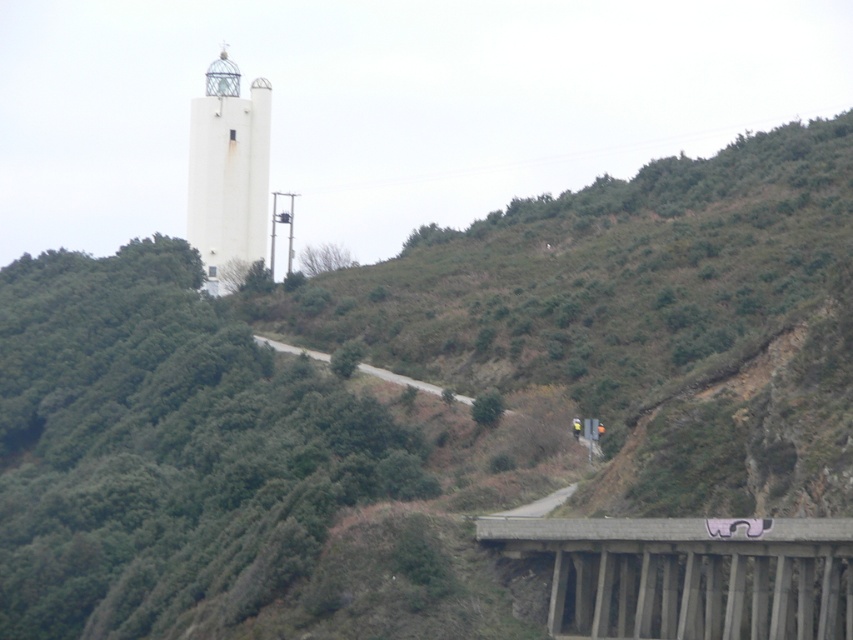
You are standing at the base of the hill looking up at the lighthouse. There are two points marked on the image. Which of the two points, point (596, 605) or point (213, 81), is closer to your current position?

Point (596, 605) is closer to the camera than point (213, 81), so the point closer to your current position is point (596, 605).